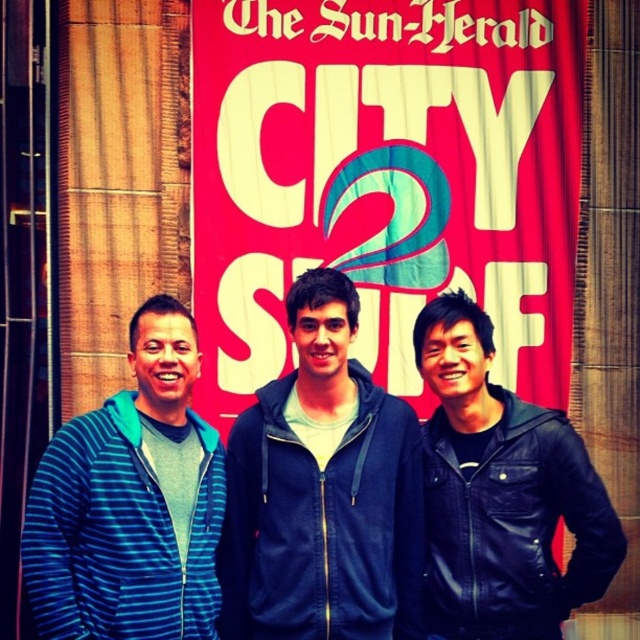
Looking at this image, is blue striped hoodie at left positioned behind black leather jacket at right?

That is False.

Is blue striped hoodie at left wider than black leather jacket at right?

Incorrect, blue striped hoodie at left's width does not surpass black leather jacket at right's.

In order to click on blue striped hoodie at left in this screenshot , I will do `click(131, 502)`.

Does point (339, 552) lie in front of point (540, 440)?

That is True.

Does dark blue hoodie at center appear on the left side of black leather jacket at right?

Indeed, dark blue hoodie at center is positioned on the left side of black leather jacket at right.

This screenshot has width=640, height=640. Describe the element at coordinates (323, 492) in the screenshot. I see `dark blue hoodie at center` at that location.

Image resolution: width=640 pixels, height=640 pixels. Identify the location of dark blue hoodie at center. (323, 492).

Is dark blue hoodie at center thinner than blue striped hoodie at left?

No.

Which is behind, point (282, 632) or point (189, 419)?

Positioned behind is point (189, 419).

Where is `dark blue hoodie at center`? The width and height of the screenshot is (640, 640). dark blue hoodie at center is located at coordinates (323, 492).